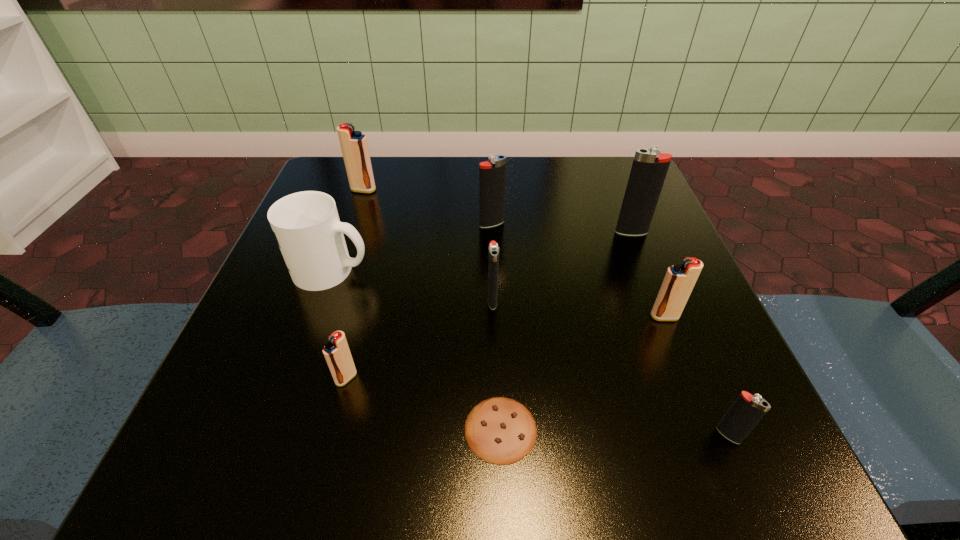
The height and width of the screenshot is (540, 960). Identify the location of free space between the eighth nearest object and the cookie. (496, 327).

Where is `free spot between the third nearest object and the nearest black igniter`? Image resolution: width=960 pixels, height=540 pixels. free spot between the third nearest object and the nearest black igniter is located at coordinates (538, 407).

Locate an element on the screen. vacant area between the tallest object and the third smallest black igniter is located at coordinates (562, 228).

This screenshot has width=960, height=540. In order to click on empty space that is in between the rightmost red igniter and the tallest igniter in this screenshot , I will do `click(648, 274)`.

Identify the location of free space that is in between the fifth nearest igniter and the second nearest red igniter. This screenshot has height=540, width=960. (648, 274).

Find the location of a particular element. vacant space that is in between the cookie and the third nearest black igniter is located at coordinates (566, 330).

You are a GUI agent. You are given a task and a screenshot of the screen. Output one action in this format:
    pyautogui.click(x=<x>, y=<y>)
    Task: Click on the vacant space that's between the leftmost igniter and the nearest red igniter
    This screenshot has height=540, width=960.
    Given the screenshot: What is the action you would take?
    pyautogui.click(x=355, y=284)

This screenshot has width=960, height=540. In order to click on empty space that is in between the shortest object and the leftmost igniter in this screenshot , I will do `click(432, 310)`.

I want to click on object that is the fifth closest to the mug, so click(x=499, y=430).

This screenshot has height=540, width=960. In order to click on object that stands as the sixth closest to the nearest black igniter in this screenshot , I will do `click(492, 176)`.